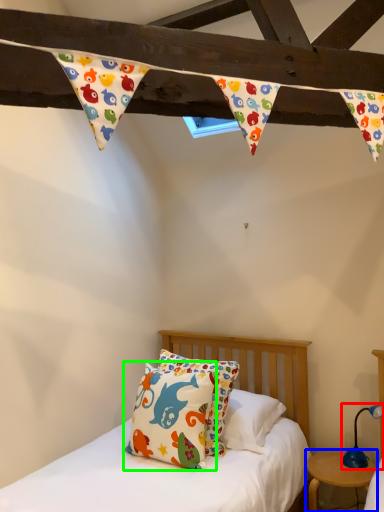
Question: Which object is the closest to the table lamp (highlighted by a red box)? Choose among these: nightstand (highlighted by a blue box) or pillow (highlighted by a green box).

Choices:
 (A) nightstand
 (B) pillow

Answer: (A)